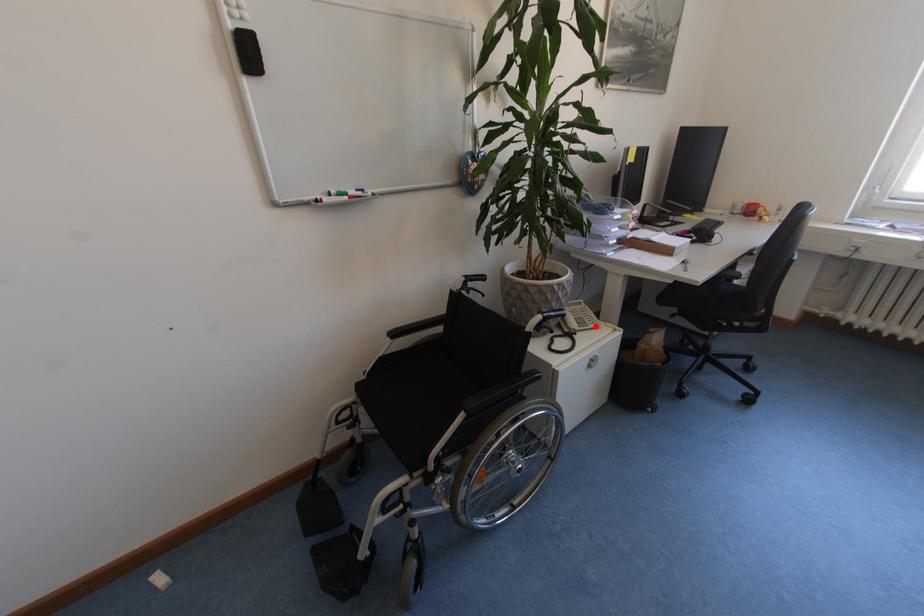
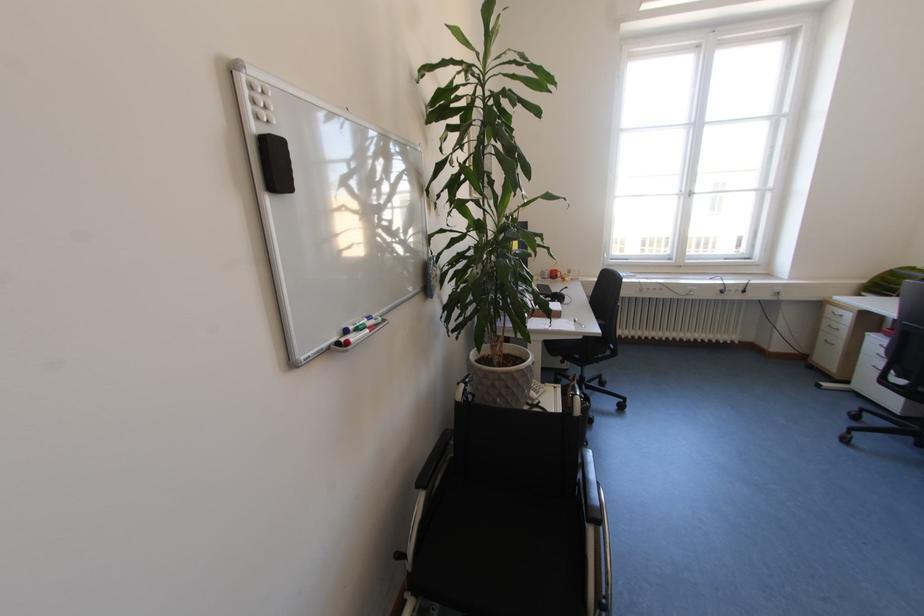
Question: I am providing you with two images of the same scene from different viewpoints. A red point is marked on the first image. Is the red point's position out of view in image 2?

Choices:
 (A) Yes
 (B) No

Answer: (B)